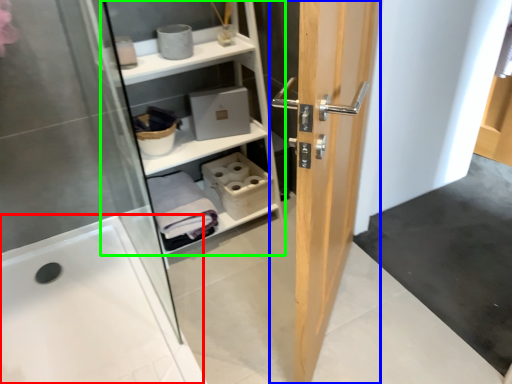
Question: Which object is positioned closest to bath (highlighted by a red box)? Select from door (highlighted by a blue box) and shelf (highlighted by a green box).

Choices:
 (A) door
 (B) shelf

Answer: (B)